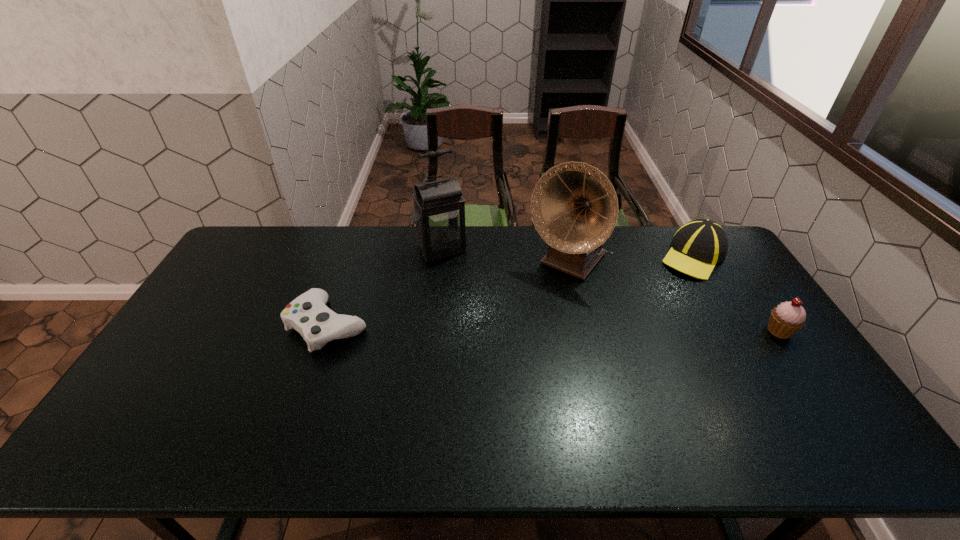
In order to click on vacant space situated 0.250m on the front-facing side of the lantern in this screenshot , I will do `click(478, 309)`.

Identify the location of free space located with the brim of the baseball cap facing forward. (667, 278).

Locate an element on the screen. This screenshot has height=540, width=960. vacant space located with the brim of the baseball cap facing forward is located at coordinates tap(648, 293).

You are a GUI agent. You are given a task and a screenshot of the screen. Output one action in this format:
    pyautogui.click(x=<x>, y=<y>)
    Task: Click on the free region located with the brim of the baseball cap facing forward
    
    Given the screenshot: What is the action you would take?
    pyautogui.click(x=665, y=279)

The image size is (960, 540). Identify the location of vacant space situated 0.240m on the horn of the third object from left to right. (510, 328).

Find the location of a particular element. This screenshot has width=960, height=540. vacant space located 0.300m on the horn of the third object from left to right is located at coordinates (498, 340).

Find the location of `free space located on the horn of the third object from left to right`. free space located on the horn of the third object from left to right is located at coordinates (492, 347).

The image size is (960, 540). Find the location of `lantern located in the far edge section of the desktop`. lantern located in the far edge section of the desktop is located at coordinates (439, 209).

This screenshot has width=960, height=540. I want to click on baseball cap situated at the far edge, so click(699, 245).

Identify the location of phonograph record that is positioned at the far edge. (x=574, y=207).